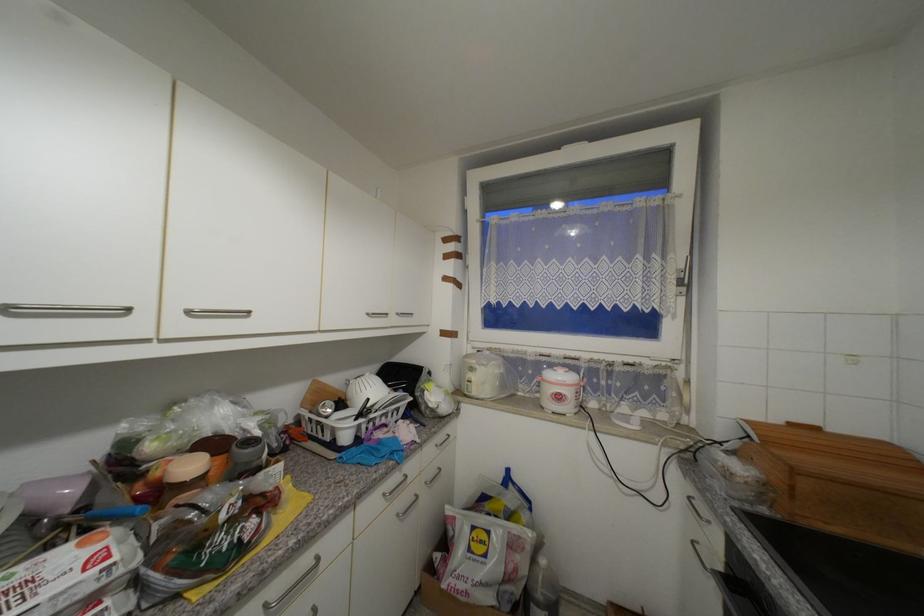
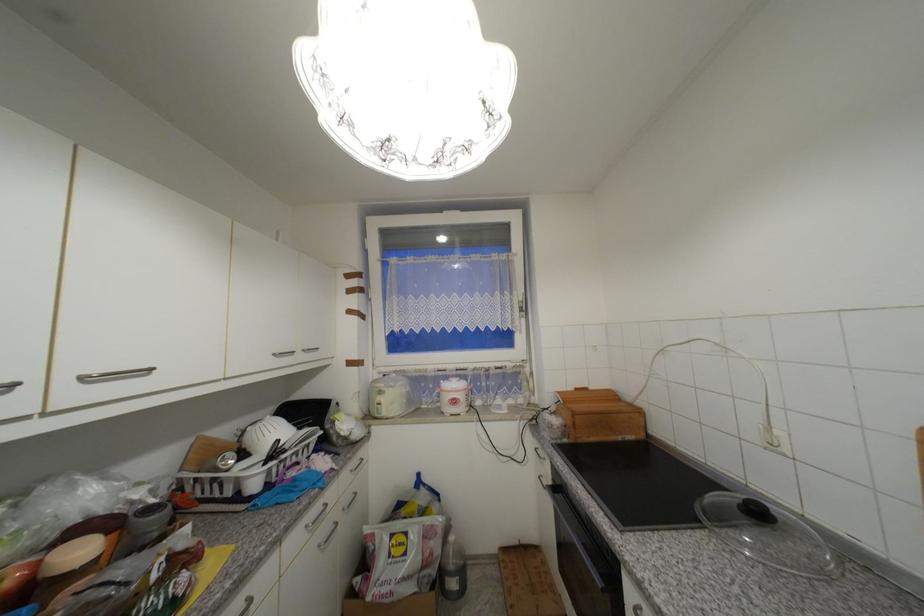
Find the pixel in the second image that matches (676,257) in the first image.

(520, 294)